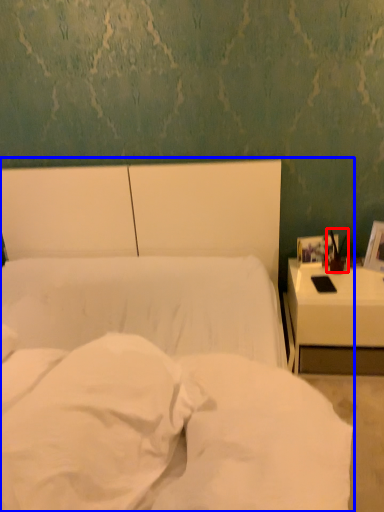
Question: Which of the following is the closest to the observer, bedside lamp (highlighted by a red box) or bed (highlighted by a blue box)?

Choices:
 (A) bedside lamp
 (B) bed

Answer: (B)